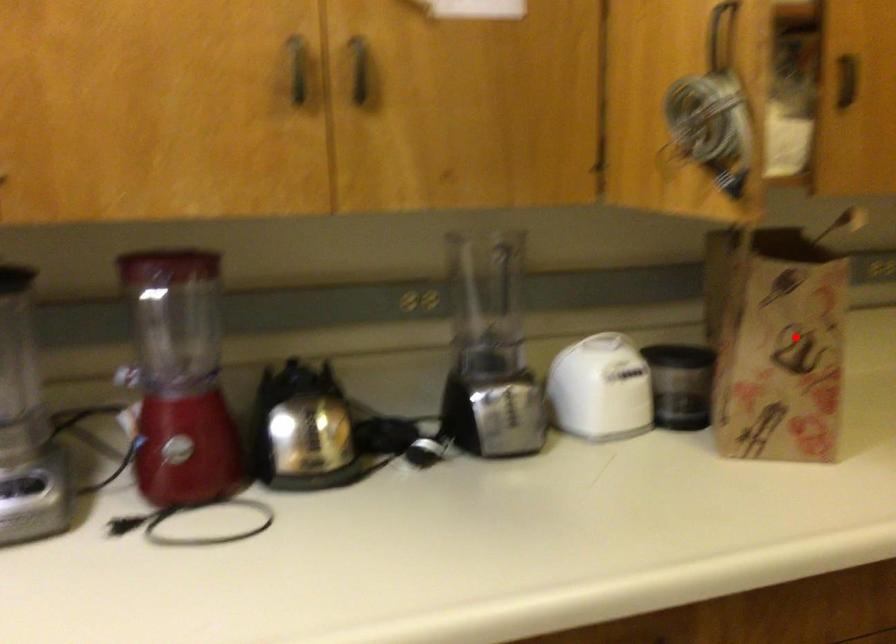
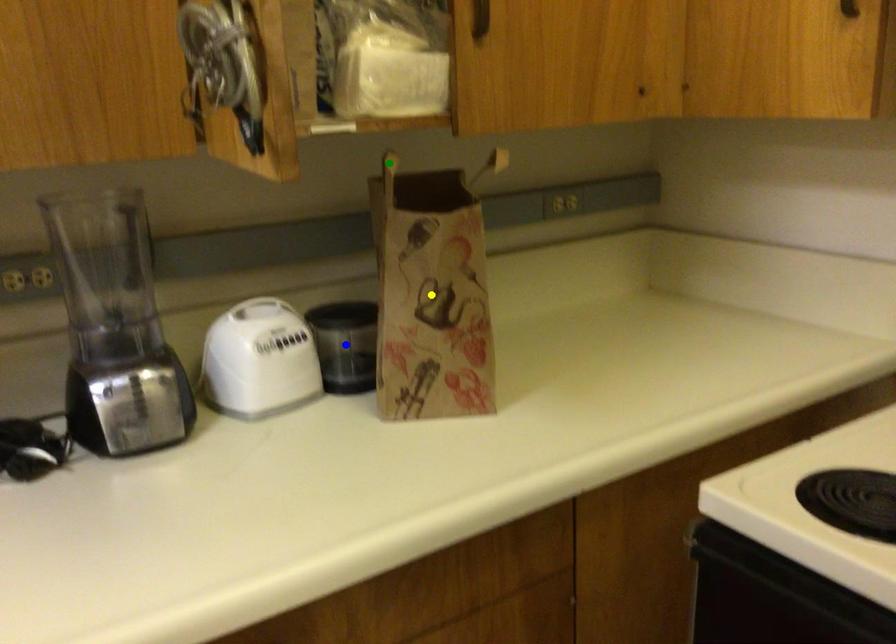
Question: I am providing you with two images of the same scene from different viewpoints. A red point is marked on the first image. You are given multiple points on the second image. Which point in image 2 is actually the same real-world point as the red point in image 1?

Choices:
 (A) green point
 (B) blue point
 (C) yellow point

Answer: (C)